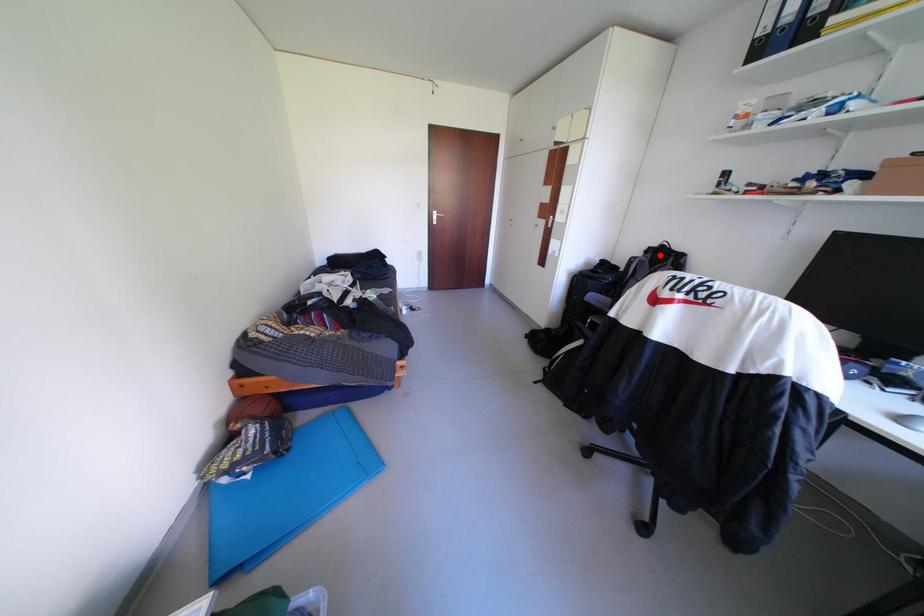
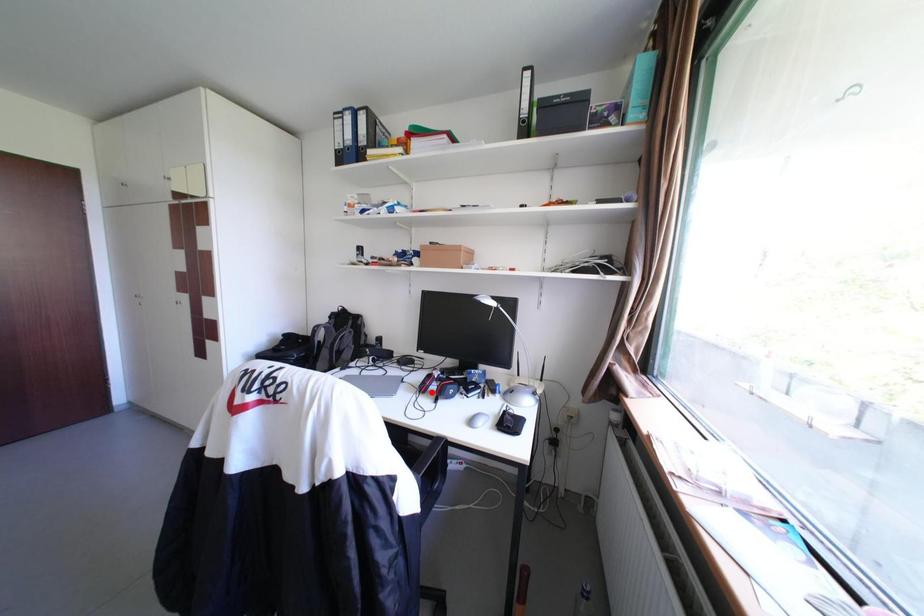
I am providing you with two images of the same scene from different viewpoints. A red point is marked on the first image and another point is marked on the second image. Do the highlighted points in image1 and image2 indicate the same real-world spot?

No